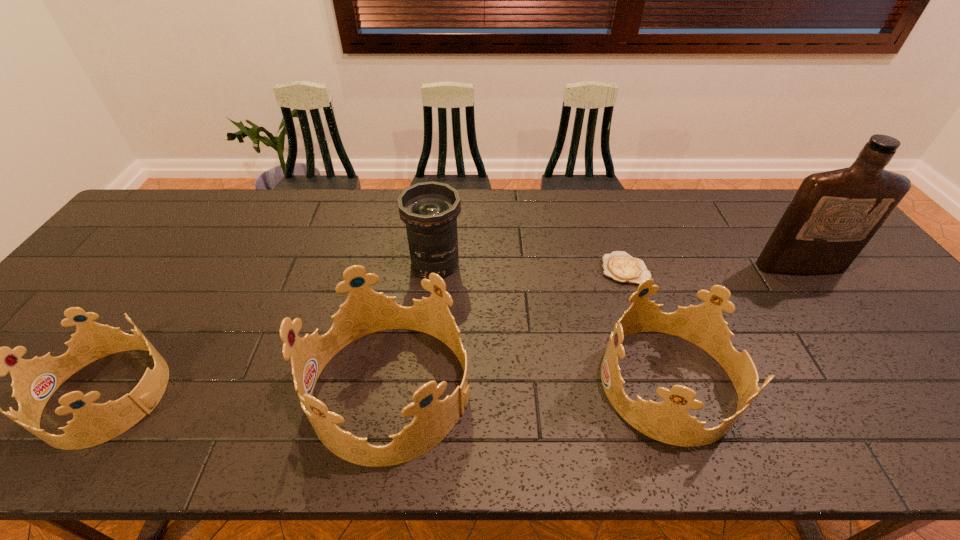
Identify the location of free location that satisfies the following two spatial constraints: 1. on the label side of the liquor; 2. on the front-facing side of the rightmost tiara. This screenshot has width=960, height=540. (886, 383).

Where is `free space in the image that satisfies the following two spatial constraints: 1. on the label side of the rightmost object; 2. on the front-facing side of the second shortest tiara`? This screenshot has height=540, width=960. free space in the image that satisfies the following two spatial constraints: 1. on the label side of the rightmost object; 2. on the front-facing side of the second shortest tiara is located at coordinates (886, 383).